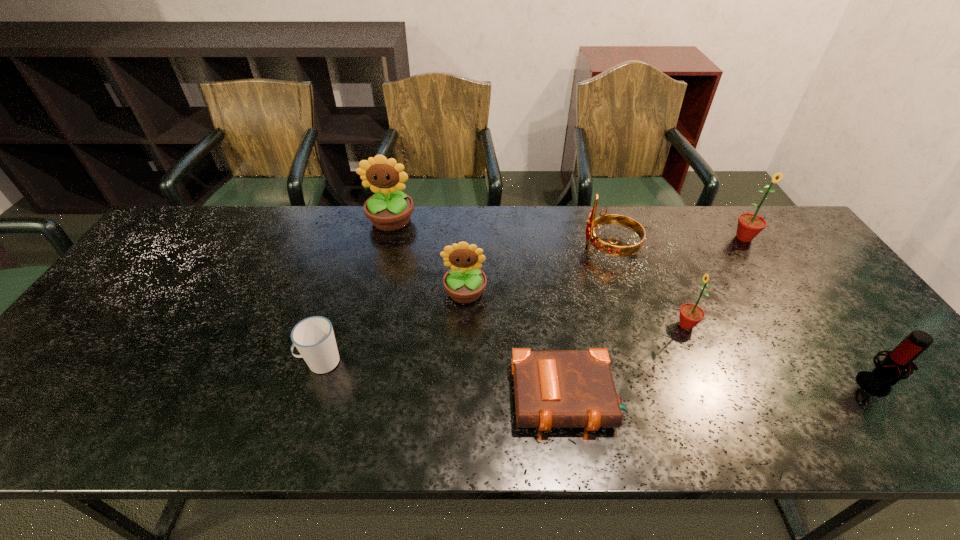
This screenshot has width=960, height=540. In order to click on white cup in this screenshot , I will do `click(313, 337)`.

The width and height of the screenshot is (960, 540). Identify the location of cup. point(313,337).

Locate an element on the screen. Image resolution: width=960 pixels, height=540 pixels. the shortest object is located at coordinates (553, 388).

Identify the location of vacant space located 0.170m on the face of the leftmost sunflower. (378, 273).

At what (x,y) coordinates should I click in order to perform the action: click on free location located 0.370m on the face of the rightmost sunflower. Please return your answer as a coordinate pair (x, y). Looking at the image, I should click on (814, 341).

Identify the location of free spot located 0.250m on the front-facing side of the red tiara. The image size is (960, 540). (500, 247).

I want to click on vacant space located 0.280m on the front-facing side of the red tiara, so click(x=491, y=247).

The height and width of the screenshot is (540, 960). Find the location of `vacant region located 0.300m on the front-facing side of the red tiara`. vacant region located 0.300m on the front-facing side of the red tiara is located at coordinates (484, 247).

The width and height of the screenshot is (960, 540). I want to click on vacant area situated on the face of the third farthest sunflower, so click(x=462, y=379).

Identify the location of vacant space located 0.310m on the face of the nearer green sunflower. Image resolution: width=960 pixels, height=540 pixels. (554, 325).